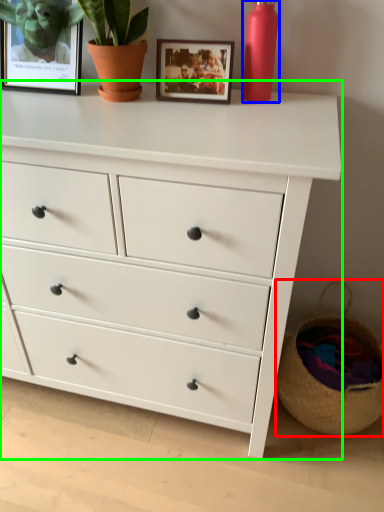
Question: Based on their relative distances, which object is farther from basket (highlighted by a red box)? Choose from bottle (highlighted by a blue box) and chest of drawers (highlighted by a green box).

Choices:
 (A) bottle
 (B) chest of drawers

Answer: (A)